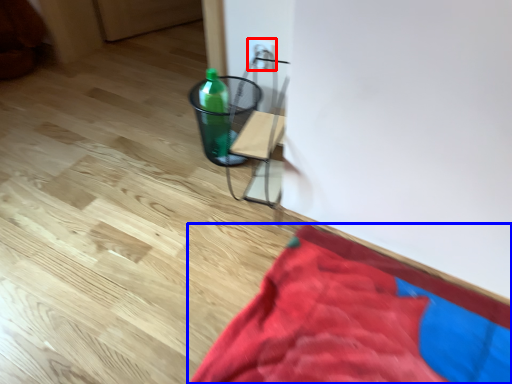
Question: Which object appears closest to the camera in this image, electric outlet (highlighted by a red box) or blanket (highlighted by a blue box)?

Choices:
 (A) electric outlet
 (B) blanket

Answer: (B)